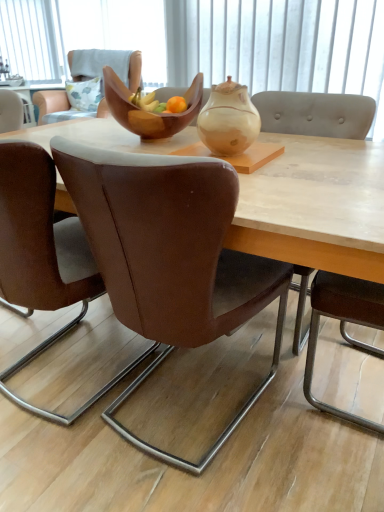
I want to click on vacant region to the right of matte beige teapot at center, so click(302, 156).